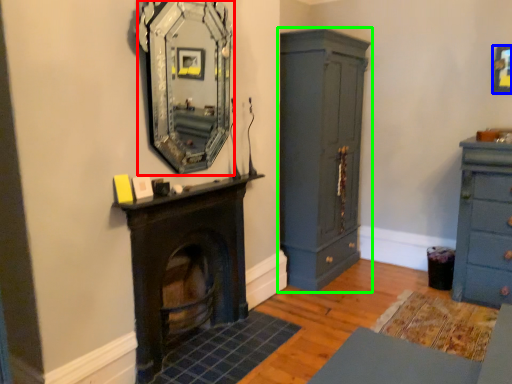
Question: Which object is the farthest from mirror (highlighted by a red box)? Choose among these: picture frame (highlighted by a blue box) or cupboard (highlighted by a green box).

Choices:
 (A) picture frame
 (B) cupboard

Answer: (A)